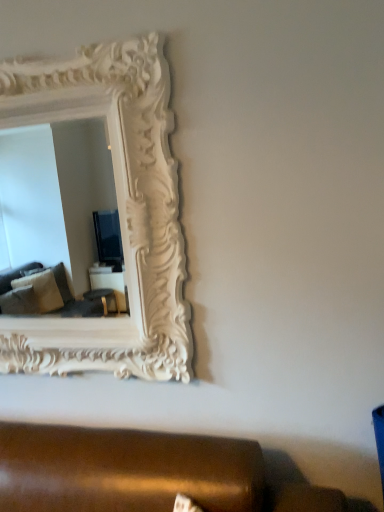
Identify the location of brown leather studio couch at lower center. The image size is (384, 512). (126, 470).

What do you see at coordinates (126, 470) in the screenshot? I see `brown leather studio couch at lower center` at bounding box center [126, 470].

Describe the element at coordinates (119, 212) in the screenshot. I see `white carved wood picture frame at upper left` at that location.

Where is `white carved wood picture frame at upper left`? The image size is (384, 512). white carved wood picture frame at upper left is located at coordinates (119, 212).

Image resolution: width=384 pixels, height=512 pixels. Identify the location of brown leather studio couch at lower center. (126, 470).

Would you say brown leather studio couch at lower center is to the left or to the right of white carved wood picture frame at upper left in the picture?

From the image, it's evident that brown leather studio couch at lower center is to the right of white carved wood picture frame at upper left.

Is the position of brown leather studio couch at lower center more distant than that of white carved wood picture frame at upper left?

No, the depth of brown leather studio couch at lower center is less than that of white carved wood picture frame at upper left.

Is point (217, 444) behind point (144, 165)?

No, it is not.

From the image's perspective, is brown leather studio couch at lower center below white carved wood picture frame at upper left?

Indeed, from the image's perspective, brown leather studio couch at lower center is shown beneath white carved wood picture frame at upper left.

From a real-world perspective, between brown leather studio couch at lower center and white carved wood picture frame at upper left, who is vertically higher?

white carved wood picture frame at upper left, from a real-world perspective.

Which object is wider, brown leather studio couch at lower center or white carved wood picture frame at upper left?

Wider between the two is brown leather studio couch at lower center.

In terms of height, does brown leather studio couch at lower center look taller or shorter compared to white carved wood picture frame at upper left?

In the image, brown leather studio couch at lower center appears to be shorter than white carved wood picture frame at upper left.

Considering the relative sizes of brown leather studio couch at lower center and white carved wood picture frame at upper left in the image provided, is brown leather studio couch at lower center bigger than white carved wood picture frame at upper left?

No, brown leather studio couch at lower center is not bigger than white carved wood picture frame at upper left.

Would you say brown leather studio couch at lower center is outside white carved wood picture frame at upper left?

brown leather studio couch at lower center is positioned outside white carved wood picture frame at upper left.

Is brown leather studio couch at lower center beside white carved wood picture frame at upper left?

No, brown leather studio couch at lower center is not with white carved wood picture frame at upper left.

Is brown leather studio couch at lower center facing away from white carved wood picture frame at upper left?

brown leather studio couch at lower center does not have its back to white carved wood picture frame at upper left.

What's the angular difference between brown leather studio couch at lower center and white carved wood picture frame at upper left's facing directions?

The facing directions of brown leather studio couch at lower center and white carved wood picture frame at upper left are 43.7 degrees apart.

Where is `picture frame above the brown leather studio couch at lower center (from the image's perspective)`? The height and width of the screenshot is (512, 384). picture frame above the brown leather studio couch at lower center (from the image's perspective) is located at coordinates (119, 212).

In the scene shown: Can you confirm if white carved wood picture frame at upper left is positioned to the right of brown leather studio couch at lower center?

In fact, white carved wood picture frame at upper left is to the left of brown leather studio couch at lower center.

Looking at this image, is the position of white carved wood picture frame at upper left less distant than that of brown leather studio couch at lower center?

No, white carved wood picture frame at upper left is behind brown leather studio couch at lower center.

Is point (92, 46) positioned after point (288, 500)?

Yes, point (92, 46) is farther from viewer.

From the image's perspective, is white carved wood picture frame at upper left below brown leather studio couch at lower center?

No.

From a real-world perspective, is white carved wood picture frame at upper left above or below brown leather studio couch at lower center?

In terms of real-world spatial position, white carved wood picture frame at upper left is above brown leather studio couch at lower center.

Considering the relative sizes of white carved wood picture frame at upper left and brown leather studio couch at lower center in the image provided, is white carved wood picture frame at upper left wider than brown leather studio couch at lower center?

No.

Is white carved wood picture frame at upper left taller or shorter than brown leather studio couch at lower center?

white carved wood picture frame at upper left is taller than brown leather studio couch at lower center.

Considering the relative sizes of white carved wood picture frame at upper left and brown leather studio couch at lower center in the image provided, is white carved wood picture frame at upper left bigger than brown leather studio couch at lower center?

Yes, white carved wood picture frame at upper left is bigger than brown leather studio couch at lower center.

Is brown leather studio couch at lower center inside white carved wood picture frame at upper left?

That's incorrect, brown leather studio couch at lower center is not inside white carved wood picture frame at upper left.

Is white carved wood picture frame at upper left in contact with brown leather studio couch at lower center?

They are not placed beside each other.

Does white carved wood picture frame at upper left turn towards brown leather studio couch at lower center?

Yes, white carved wood picture frame at upper left is turned towards brown leather studio couch at lower center.

Locate an element on the screen. picture frame above the brown leather studio couch at lower center (from a real-world perspective) is located at coordinates (119, 212).

Where is `studio couch below the white carved wood picture frame at upper left (from the image's perspective)`? The width and height of the screenshot is (384, 512). studio couch below the white carved wood picture frame at upper left (from the image's perspective) is located at coordinates (126, 470).

This screenshot has height=512, width=384. What are the coordinates of `picture frame on the left of brown leather studio couch at lower center` in the screenshot? It's located at (119, 212).